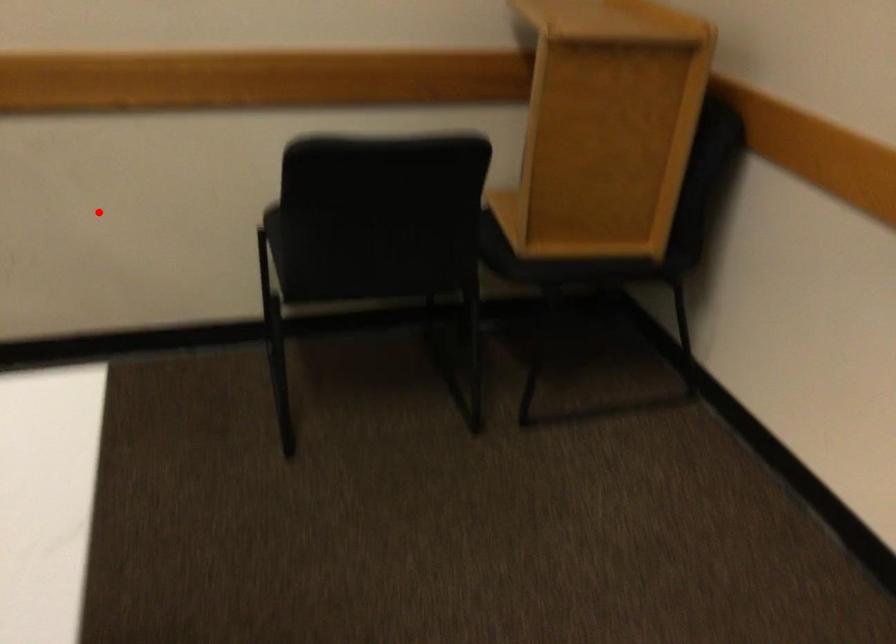
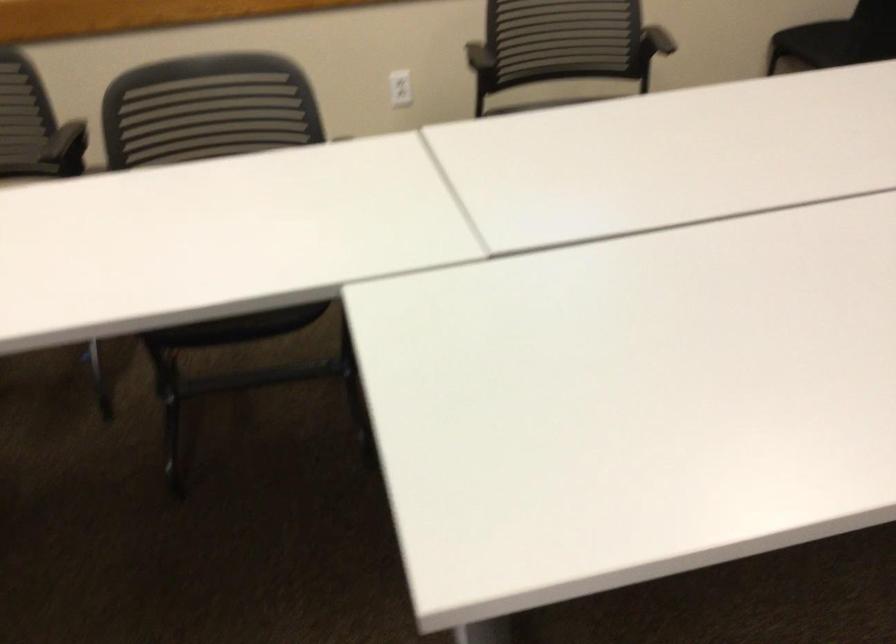
In the second image, find the point that corresponds to the highlighted location in the first image.

(676, 43)